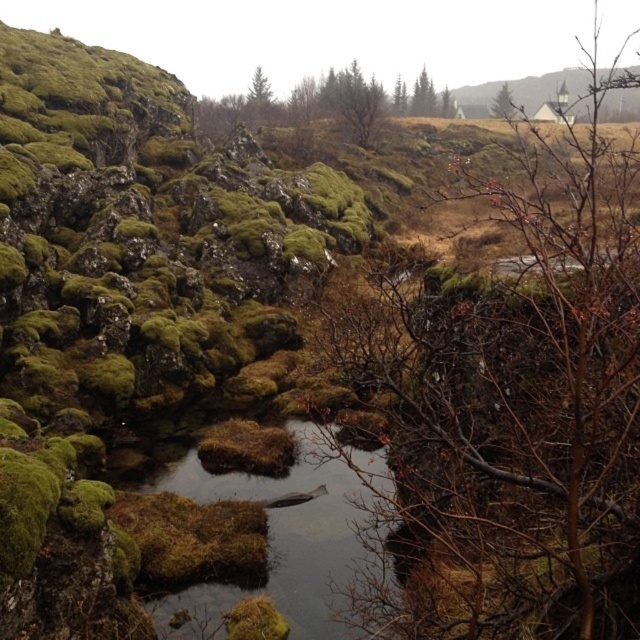
Question: Can you confirm if green mossy stream at center is smaller than green mossy tree at upper right?

Choices:
 (A) no
 (B) yes

Answer: (B)

Question: Which point is closer to the camera taking this photo?

Choices:
 (A) (365, 84)
 (B) (509, 100)
 (C) (600, 145)

Answer: (C)

Question: Does brown leafless branches at center come behind green mossy tree at upper right?

Choices:
 (A) no
 (B) yes

Answer: (A)

Question: Which object is farther from the camera taking this photo?

Choices:
 (A) green mossy stream at center
 (B) green mossy rock at upper center
 (C) green mossy tree at upper right

Answer: (C)

Question: Which object is closer to the camera taking this photo?

Choices:
 (A) brown leafless branches at center
 (B) green mossy rock at upper center

Answer: (A)

Question: Where is green mossy stream at center located in relation to green mossy tree at upper right in the image?

Choices:
 (A) right
 (B) left

Answer: (B)